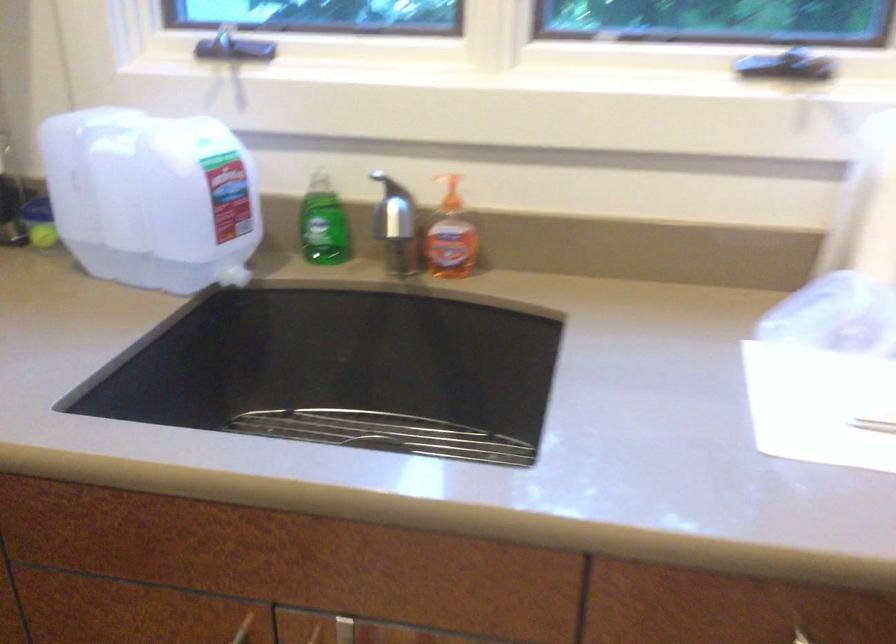
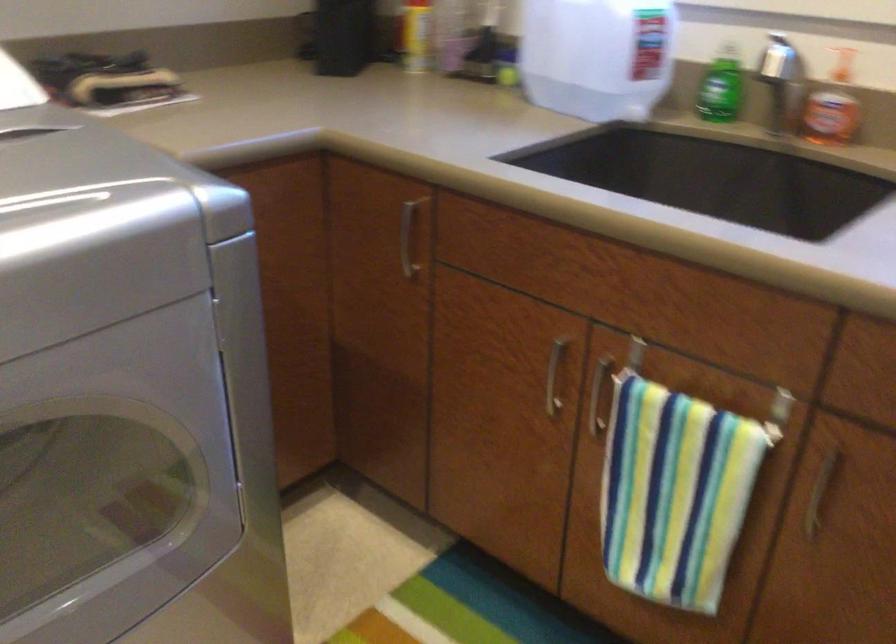
Find the pixel in the second image that matches point (325, 240) in the first image.

(718, 105)